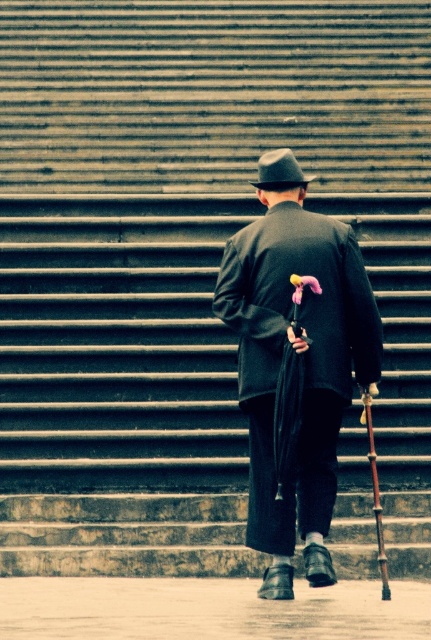
Between matte black coat at center and matte black fedora at center, which one appears on the right side from the viewer's perspective?

From the viewer's perspective, matte black coat at center appears more on the right side.

Can you confirm if matte black coat at center is positioned above matte black fedora at center?

Incorrect, matte black coat at center is not positioned above matte black fedora at center.

Does point (280, 422) come farther from viewer compared to point (294, 173)?

No, (280, 422) is closer to viewer.

Identify the location of matte black coat at center. (296, 371).